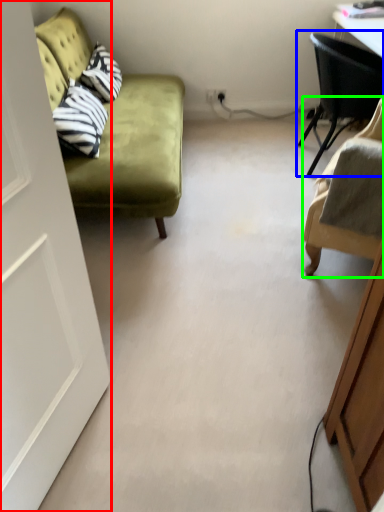
Question: Which object is the closest to the door (highlighted by a red box)? Choose among these: chair (highlighted by a blue box) or chair (highlighted by a green box).

Choices:
 (A) chair
 (B) chair

Answer: (B)